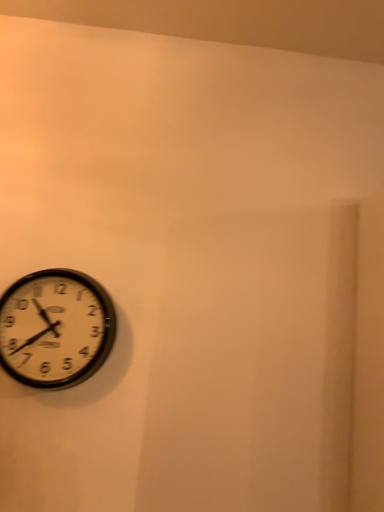
What do you see at coordinates (55, 328) in the screenshot?
I see `white plastic clock at left` at bounding box center [55, 328].

The width and height of the screenshot is (384, 512). I want to click on white plastic clock at left, so click(55, 328).

Locate an element on the screen. The height and width of the screenshot is (512, 384). white plastic clock at left is located at coordinates (55, 328).